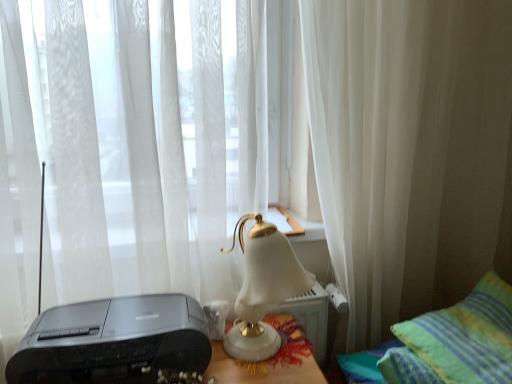
Where is `free space above matte black printer at lower left (from a real-world perspective)`? The image size is (512, 384). free space above matte black printer at lower left (from a real-world perspective) is located at coordinates (103, 324).